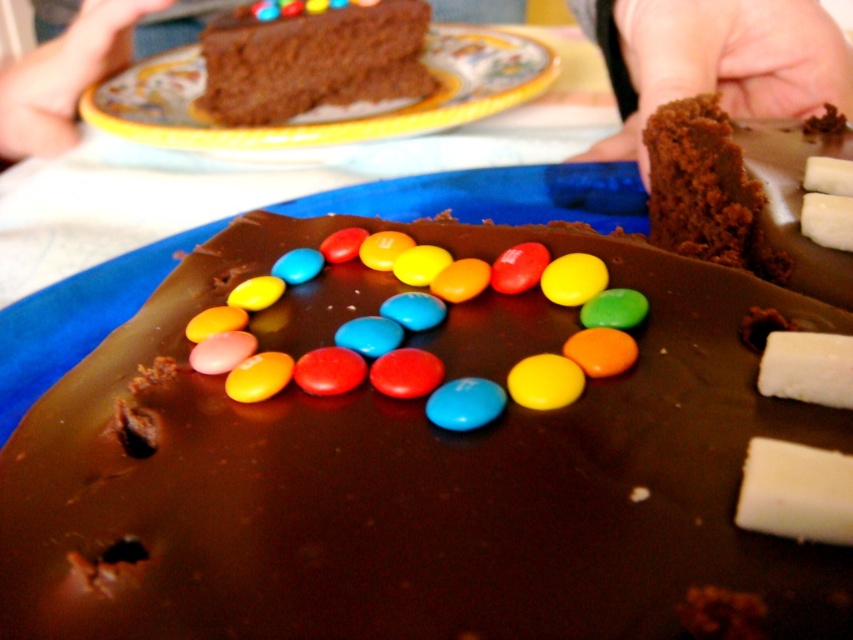
You are at the center of the image and want to reach the chocolate cake at upper center. Which direction should you move to get closer to it?

Since the chocolate cake at upper center is located at point (312, 61), you should move upward and slightly to the left to reach it.